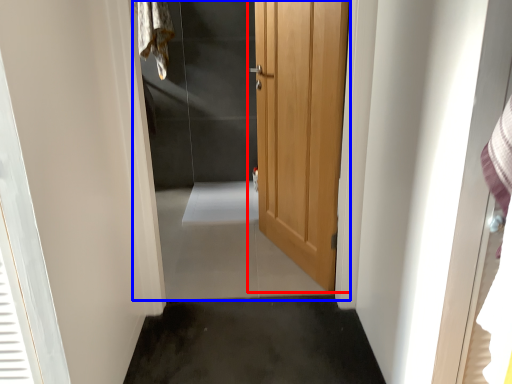
Question: Which point is closer to the camera, door (highlighted by a red box) or elevator (highlighted by a blue box)?

Choices:
 (A) door
 (B) elevator

Answer: (B)